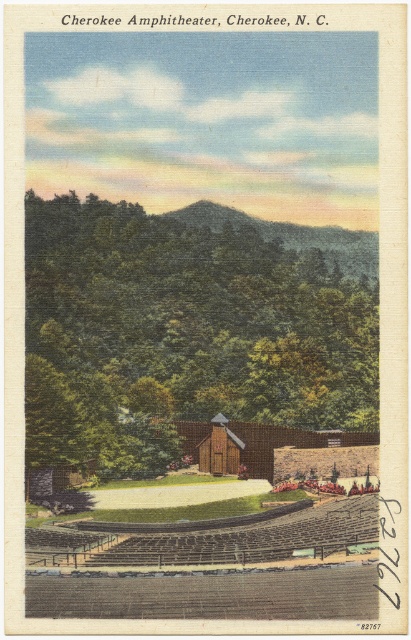
Is green leafy tree at center positioned at the back of green textured hillside at center?

That is False.

Is point (119, 419) farther from camera compared to point (226, 209)?

No, (119, 419) is in front of (226, 209).

Find the location of a particular element. The image size is (411, 640). green leafy tree at center is located at coordinates (193, 337).